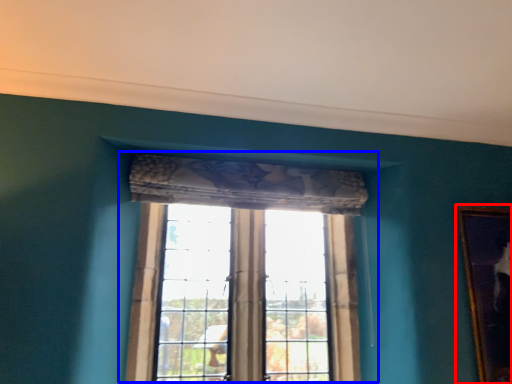
Question: Among these objects, which one is nearest to the camera, picture frame (highlighted by a red box) or window (highlighted by a blue box)?

Choices:
 (A) picture frame
 (B) window

Answer: (B)